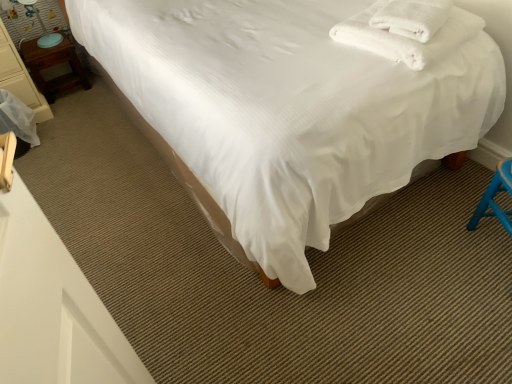
This screenshot has height=384, width=512. What are the coordinates of `vacant space situated above white soft towel at upper right (from a real-world perspective)` in the screenshot? It's located at (417, 6).